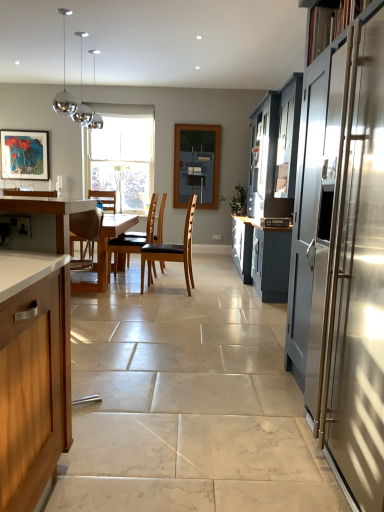
Measure the distance between point (146,241) and camera.

Point (146,241) is 5.58 meters away from camera.

The width and height of the screenshot is (384, 512). I want to click on matte glass window screen at center, so click(x=197, y=165).

What is the approximate width of matte wooden picture frame at upper left?

The width of matte wooden picture frame at upper left is 2.04 inches.

Identify the location of stainless steel cabinet at right, which is counted as the 1th cabinetry, starting from the front. This screenshot has width=384, height=512. (343, 254).

What do you see at coordinates (343, 254) in the screenshot? I see `stainless steel cabinet at right, which is counted as the 1th cabinetry, starting from the front` at bounding box center [343, 254].

Where is `matte blue cabinet at right, which appears as the third cabinetry when viewed from the left`? matte blue cabinet at right, which appears as the third cabinetry when viewed from the left is located at coordinates (270, 193).

Looking at their sizes, would you say matte wooden picture frame at upper left is wider or thinner than brown leather chair at center, the 2th chair positioned from the right?

In the image, matte wooden picture frame at upper left appears to be more narrow than brown leather chair at center, the 2th chair positioned from the right.

Which of these two, matte wooden picture frame at upper left or brown leather chair at center, which is the 1th chair from left to right, stands taller?

With more height is brown leather chair at center, which is the 1th chair from left to right.

In the image, is matte wooden picture frame at upper left on the left side or the right side of brown leather chair at center, arranged as the 2th chair when viewed from the front?

matte wooden picture frame at upper left is positioned on brown leather chair at center, arranged as the 2th chair when viewed from the front,'s left side.

Based on their sizes in the image, would you say matte wooden picture frame at upper left is bigger or smaller than brown leather chair at center, which is the 1th chair from left to right?

matte wooden picture frame at upper left is smaller than brown leather chair at center, which is the 1th chair from left to right.

Which of these two, matte wooden picture frame at upper left or matte blue cabinet at right, the 1th cabinetry from the back, is smaller?

Smaller between the two is matte wooden picture frame at upper left.

Is matte wooden picture frame at upper left facing away from matte blue cabinet at right, which appears as the third cabinetry when viewed from the left?

matte wooden picture frame at upper left is not turned away from matte blue cabinet at right, which appears as the third cabinetry when viewed from the left.

Does matte wooden picture frame at upper left have a greater width compared to matte blue cabinet at right, placed as the third cabinetry when sorted from front to back?

No.

Who is more distant, matte wooden picture frame at upper left or matte blue cabinet at right, acting as the first cabinetry starting from the right?

matte wooden picture frame at upper left is behind.

In the scene shown: Is brown leather chair at center, which is the 1th chair from left to right, next to wooden countertop at left, which is counted as the 1th cabinetry, starting from the left?

No, brown leather chair at center, which is the 1th chair from left to right, is not with wooden countertop at left, which is counted as the 1th cabinetry, starting from the left.

Can you confirm if brown leather chair at center, the 2th chair positioned from the right, is smaller than wooden countertop at left, which ranks as the 2th cabinetry in back-to-front order?

Correct, brown leather chair at center, the 2th chair positioned from the right, occupies less space than wooden countertop at left, which ranks as the 2th cabinetry in back-to-front order.

Could you tell me if brown leather chair at center, arranged as the 2th chair when viewed from the front, is turned towards wooden countertop at left, which is counted as the 2th cabinetry, starting from the front?

No, brown leather chair at center, arranged as the 2th chair when viewed from the front, is not turned towards wooden countertop at left, which is counted as the 2th cabinetry, starting from the front.

Looking at this image, from the image's perspective, which one is positioned higher, brown leather chair at center, which is counted as the 1th chair, starting from the back, or wooden countertop at left, which ranks as the 2th cabinetry in back-to-front order?

brown leather chair at center, which is counted as the 1th chair, starting from the back, is shown above in the image.

Based on the photo, which object is wider, brown leather chair at center, the 2th chair positioned from the right, or clear glass window at center?

brown leather chair at center, the 2th chair positioned from the right.

How different are the orientations of brown leather chair at center, arranged as the 2th chair when viewed from the front, and clear glass window at center in degrees?

The facing directions of brown leather chair at center, arranged as the 2th chair when viewed from the front, and clear glass window at center are 92.1 degrees apart.

Does brown leather chair at center, the 2th chair positioned from the right, have a smaller size compared to clear glass window at center?

Indeed, brown leather chair at center, the 2th chair positioned from the right, has a smaller size compared to clear glass window at center.

Is brown leather chair at center, which is counted as the 1th chair, starting from the back, surrounding clear glass window at center?

That's incorrect, clear glass window at center is not inside brown leather chair at center, which is counted as the 1th chair, starting from the back.

At what (x,y) coordinates should I click in order to perform the action: click on window behind the brown leather chair at center, which is counted as the 2th chair, starting from the back. Please return your answer as a coordinate pair (x, y). Looking at the image, I should click on 123,155.

Looking at this image, is the surface of clear glass window at center in direct contact with brown leather chair at center, which is counted as the first chair, starting from the front?

No, clear glass window at center is not next to brown leather chair at center, which is counted as the first chair, starting from the front.

Is clear glass window at center aimed at brown leather chair at center, positioned as the 2th chair in left-to-right order?

Yes, clear glass window at center is turned towards brown leather chair at center, positioned as the 2th chair in left-to-right order.

From a real-world perspective, which is physically above, clear glass window at center or brown leather chair at center, which is counted as the 2th chair, starting from the back?

From a 3D spatial view, clear glass window at center is above.

Is matte glass window screen at center looking in the opposite direction of brown leather chair at center, the 2th chair positioned from the right?

No, matte glass window screen at center is not facing the opposite direction of brown leather chair at center, the 2th chair positioned from the right.

How different are the orientations of matte glass window screen at center and brown leather chair at center, which is counted as the 1th chair, starting from the back, in degrees?

matte glass window screen at center and brown leather chair at center, which is counted as the 1th chair, starting from the back, are facing 90.8 degrees away from each other.

Would you consider matte glass window screen at center to be distant from brown leather chair at center, arranged as the 2th chair when viewed from the front?

Absolutely, matte glass window screen at center is distant from brown leather chair at center, arranged as the 2th chair when viewed from the front.

Is matte glass window screen at center taller or shorter than brown leather chair at center, which is the 1th chair from left to right?

Considering their sizes, matte glass window screen at center has more height than brown leather chair at center, which is the 1th chair from left to right.

Looking at this image, does matte glass window screen at center turn towards brown leather chair at center, which is counted as the 2th chair, starting from the back?

Yes, matte glass window screen at center faces towards brown leather chair at center, which is counted as the 2th chair, starting from the back.

Is matte glass window screen at center shorter than brown leather chair at center, the 1th chair from the right?

No.

Consider the image. From the image's perspective, does matte glass window screen at center appear lower than brown leather chair at center, which is counted as the 2th chair, starting from the back?

No, from the image's perspective, matte glass window screen at center is not below brown leather chair at center, which is counted as the 2th chair, starting from the back.

Where is `chair that is the 1st one when counting forward from the matte wooden picture frame at upper left`? chair that is the 1st one when counting forward from the matte wooden picture frame at upper left is located at coordinates (132, 239).

From the image's perspective, which cabinetry is the 1st one below the matte wooden picture frame at upper left? Please provide its 2D coordinates.

[(270, 193)]

Looking at the image, which one is located further to clear glass window at center, brown leather chair at center, which is the 1th chair from left to right, or satin silver microwave at center?

Based on the image, satin silver microwave at center appears to be further to clear glass window at center.

Considering their positions, is matte blue cabinet at right, which appears as the third cabinetry when viewed from the left, positioned further to brown leather chair at center, arranged as the 2th chair when viewed from the front, than clear glass window at center?

Answer: matte blue cabinet at right, which appears as the third cabinetry when viewed from the left, is positioned further to the anchor brown leather chair at center, arranged as the 2th chair when viewed from the front.

Considering their positions, is matte blue cabinet at right, acting as the first cabinetry starting from the right, positioned further to matte glass window screen at center than brown leather chair at center, which is counted as the first chair, starting from the front?

Among the two, brown leather chair at center, which is counted as the first chair, starting from the front, is located further to matte glass window screen at center.

When comparing their distances from matte glass window screen at center, does clear glass window at center or wooden countertop at left, which is counted as the 1th cabinetry, starting from the left, seem closer?

clear glass window at center is positioned closer to the anchor matte glass window screen at center.

Looking at the image, which one is located further to satin silver microwave at center, matte blue cabinet at right, the 1th cabinetry from the back, or brown leather chair at center, the 1th chair from the right?

brown leather chair at center, the 1th chair from the right, lies further to satin silver microwave at center than the other object.

Considering their positions, is wooden countertop at left, positioned as the 3th cabinetry in right-to-left order, positioned closer to stainless steel cabinet at right, which is counted as the 2th cabinetry, starting from the right, than clear glass window at center?

wooden countertop at left, positioned as the 3th cabinetry in right-to-left order.

Looking at the image, which one is located closer to satin silver microwave at center, matte wooden picture frame at upper left or wooden countertop at left, which is counted as the 1th cabinetry, starting from the left?

wooden countertop at left, which is counted as the 1th cabinetry, starting from the left, is positioned closer to the anchor satin silver microwave at center.

Which object lies further to the anchor point matte blue cabinet at right, which appears as the third cabinetry when viewed from the left, brown leather chair at center, which is counted as the 2th chair, starting from the back, or wooden countertop at left, which is counted as the 1th cabinetry, starting from the left?

Among the two, wooden countertop at left, which is counted as the 1th cabinetry, starting from the left, is located further to matte blue cabinet at right, which appears as the third cabinetry when viewed from the left.

I want to click on appliance between stainless steel cabinet at right, which is counted as the 2th cabinetry, starting from the right, and brown leather chair at center, which is counted as the first chair, starting from the front, from front to back, so click(276, 222).

Where is `cabinetry between wooden countertop at left, which is counted as the 1th cabinetry, starting from the left, and satin silver microwave at center from front to back`? Image resolution: width=384 pixels, height=512 pixels. cabinetry between wooden countertop at left, which is counted as the 1th cabinetry, starting from the left, and satin silver microwave at center from front to back is located at coordinates (270, 193).

Find the location of a particular element. cabinetry between wooden countertop at left, which is counted as the 2th cabinetry, starting from the front, and clear glass window at center in the front-back direction is located at coordinates (270, 193).

Locate an element on the screen. appliance located between stainless steel cabinet at right, which is counted as the 2th cabinetry, starting from the right, and matte glass window screen at center in the depth direction is located at coordinates pyautogui.click(x=276, y=222).